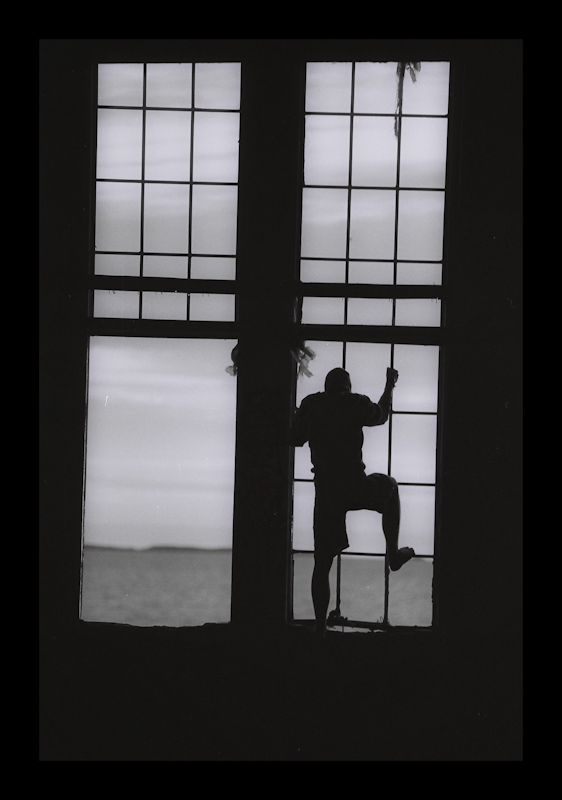
Identify the location of window. (194, 212), (379, 580), (223, 566), (389, 234).